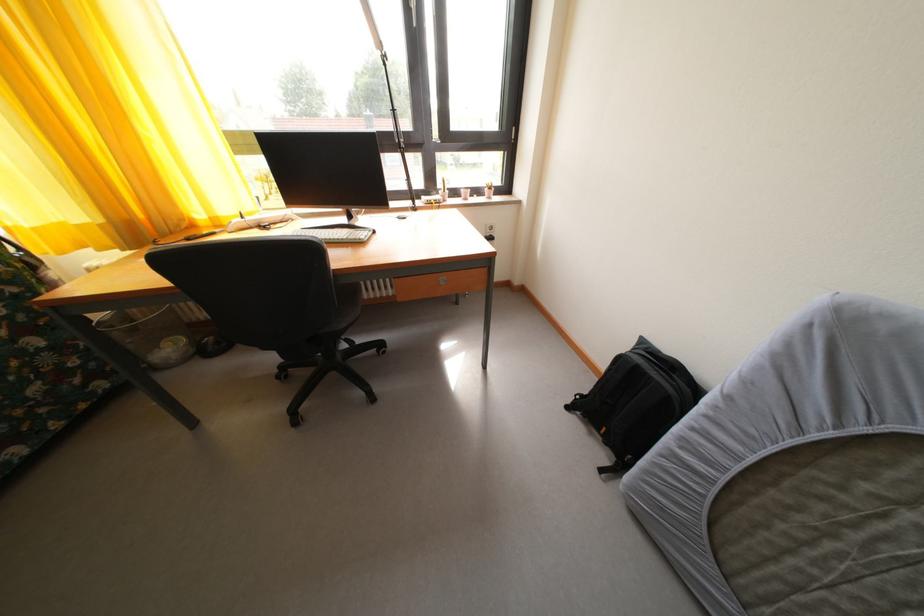
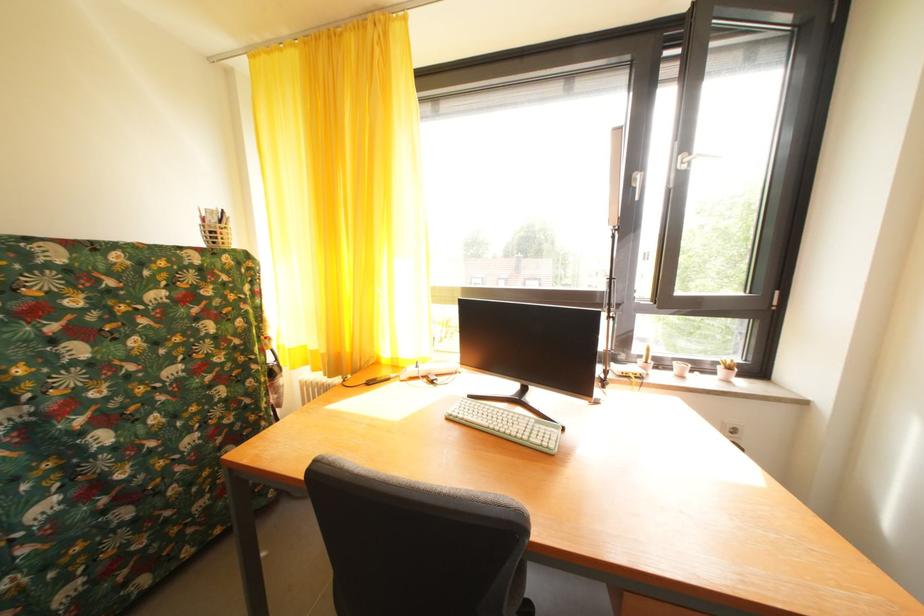
How did the camera likely rotate?

The camera's rotation is toward left-up.